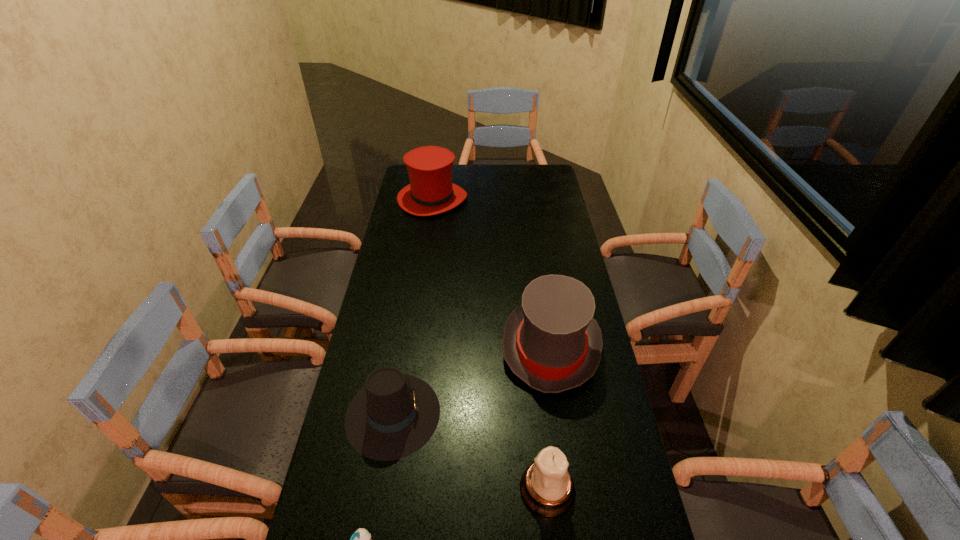
You are a GUI agent. You are given a task and a screenshot of the screen. Output one action in this format:
    pyautogui.click(x=<x>, y=<y>)
    Task: Click on the free space between the candle holder and the shortest hat
    The image size is (960, 540).
    Given the screenshot: What is the action you would take?
    pyautogui.click(x=470, y=451)

Identify the location of unoccupied area between the rightmost hat and the shortest hat. (471, 381).

Locate which object ranks third in proximity to the farthest object. Please provide its 2D coordinates. Your answer should be formatted as a tuple, i.e. [(x, y)], where the tuple contains the x and y coordinates of a point satisfying the conditions above.

[(547, 488)]

Identify which object is located as the second nearest to the shortest hat. Please provide its 2D coordinates. Your answer should be formatted as a tuple, i.e. [(x, y)], where the tuple contains the x and y coordinates of a point satisfying the conditions above.

[(551, 342)]

Choose which hat is the nearest neighbor to the rightmost hat. Please provide its 2D coordinates. Your answer should be formatted as a tuple, i.e. [(x, y)], where the tuple contains the x and y coordinates of a point satisfying the conditions above.

[(394, 415)]

Identify which hat is the closest to the rightmost hat. Please provide its 2D coordinates. Your answer should be formatted as a tuple, i.e. [(x, y)], where the tuple contains the x and y coordinates of a point satisfying the conditions above.

[(394, 415)]

Image resolution: width=960 pixels, height=540 pixels. What are the coordinates of `vacant region that satisfies the following two spatial constraints: 1. on the front-facing side of the shortest hat; 2. on the back side of the candle holder` in the screenshot? It's located at (381, 489).

Where is `vacant area that satisfies the following two spatial constraints: 1. on the front-facing side of the candle holder; 2. on the right side of the shortest hat`? This screenshot has width=960, height=540. vacant area that satisfies the following two spatial constraints: 1. on the front-facing side of the candle holder; 2. on the right side of the shortest hat is located at coordinates (381, 489).